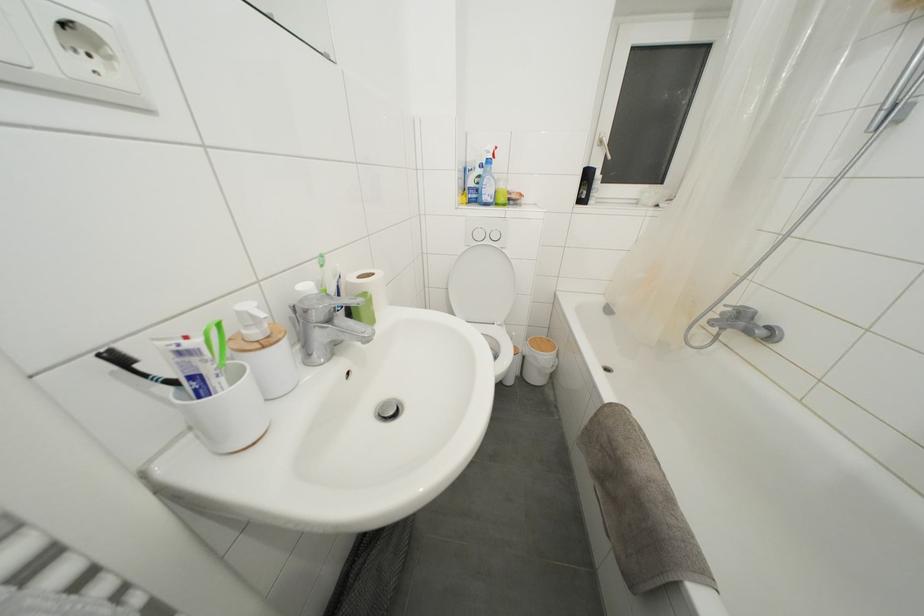
Find where to push the wooden trash can lid. Please return your answer as a coordinate pair (x, y).

(541, 345)